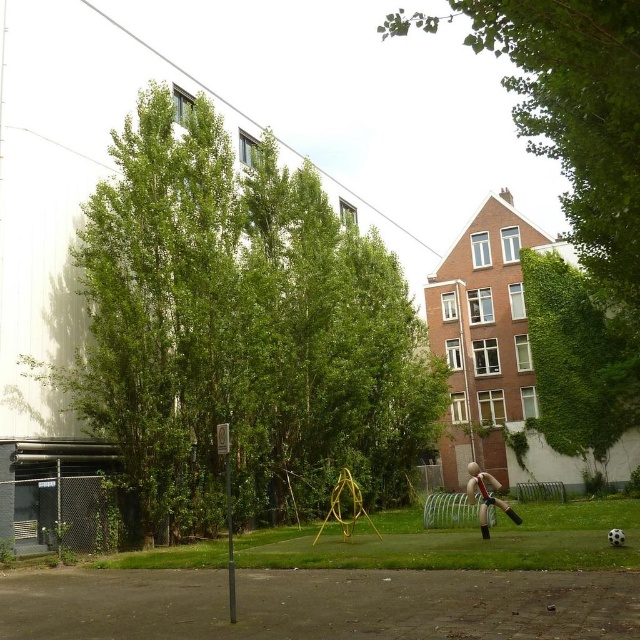
Can you confirm if green leafy tree at center is positioned below smooth beige mannequin at center?

Incorrect, green leafy tree at center is not positioned below smooth beige mannequin at center.

Who is higher up, green leafy tree at center or smooth beige mannequin at center?

Positioned higher is green leafy tree at center.

Which is behind, point (428, 417) or point (472, 500)?

Point (428, 417)

Find the location of a particular element. The height and width of the screenshot is (640, 640). green leafy tree at center is located at coordinates (240, 332).

Locate an element on the screen. green leafy tree at center is located at coordinates [240, 332].

Is green leafy tree at center taller than green leafy tree at upper center?

In fact, green leafy tree at center may be shorter than green leafy tree at upper center.

Which is in front, point (202, 125) or point (577, 28)?

Positioned in front is point (577, 28).

Where is `green leafy tree at center`? This screenshot has height=640, width=640. green leafy tree at center is located at coordinates tap(240, 332).

Is green leafy tree at upper center wider than smooth beige mannequin at center?

Indeed, green leafy tree at upper center has a greater width compared to smooth beige mannequin at center.

Which is above, green leafy tree at upper center or smooth beige mannequin at center?

green leafy tree at upper center is above.

Locate an element on the screen. The height and width of the screenshot is (640, 640). green leafy tree at upper center is located at coordinates (570, 109).